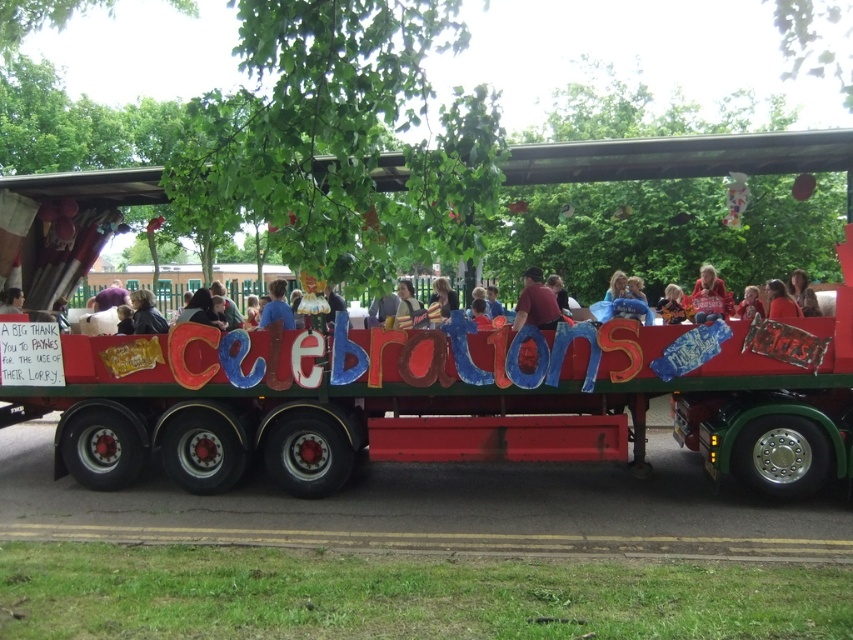
Question: Which object is closer to the camera taking this photo?

Choices:
 (A) smooth brown hair at center
 (B) red painted wooden float at center

Answer: (A)

Question: Is dark brown leather jacket at center bigger than matte brown jacket at center?

Choices:
 (A) yes
 (B) no

Answer: (A)

Question: Does red sweater at center appear on the right side of smooth brown hair at center?

Choices:
 (A) yes
 (B) no

Answer: (B)

Question: Which object appears farthest from the camera in this image?

Choices:
 (A) blue fabric shirt at center
 (B) dark brown hair at center
 (C) red painted wooden float at center
 (D) matte black shirt at center

Answer: (D)

Question: Does blue fabric shirt at center appear under smooth red shirt at center?

Choices:
 (A) yes
 (B) no

Answer: (A)

Question: Which object is closer to the camera taking this photo?

Choices:
 (A) matte black shirt at center
 (B) dark brown hair at upper center
 (C) red sweater at center
 (D) red painted wooden float at center

Answer: (D)